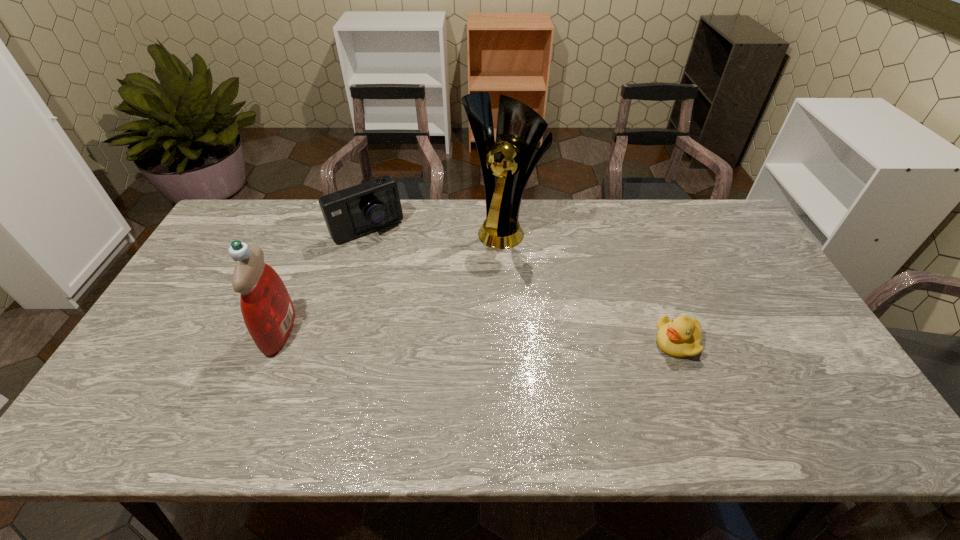
You are a GUI agent. You are given a task and a screenshot of the screen. Output one action in this format:
    pyautogui.click(x=<x>, y=<y>)
    Task: Click on the vacant space located on the front-facing side of the shortest object
    
    Given the screenshot: What is the action you would take?
    pyautogui.click(x=579, y=342)

Locate an element on the screen. This screenshot has height=540, width=960. free location located 0.130m on the front-facing side of the shortest object is located at coordinates (606, 342).

The width and height of the screenshot is (960, 540). In order to click on blank space located at the front of the award, where the globe is visible in this screenshot , I will do `click(447, 301)`.

Find the location of a particular element. The width and height of the screenshot is (960, 540). vacant space situated 0.090m at the front of the award, where the globe is visible is located at coordinates (474, 264).

The height and width of the screenshot is (540, 960). I want to click on vacant region located 0.050m at the front of the award, where the globe is visible, so click(479, 256).

Find the location of `vacant area situated on the front-facing side of the third tallest object`. vacant area situated on the front-facing side of the third tallest object is located at coordinates click(x=404, y=280).

Where is `free space located on the front-facing side of the third tallest object`? Image resolution: width=960 pixels, height=540 pixels. free space located on the front-facing side of the third tallest object is located at coordinates (394, 262).

Identify the location of vacant space located on the front-facing side of the third tallest object. (429, 317).

Locate an element on the screen. This screenshot has width=960, height=540. award present at the far edge is located at coordinates (504, 164).

The height and width of the screenshot is (540, 960). What are the coordinates of `camera situated at the far edge` in the screenshot? It's located at (361, 209).